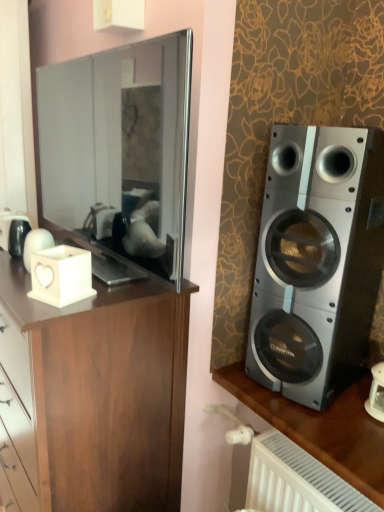
Question: Should I look upward or downward to see matte black mirror at left?

Choices:
 (A) down
 (B) up

Answer: (B)

Question: Should I look upward or downward to see metallic silver speaker at right?

Choices:
 (A) down
 (B) up

Answer: (A)

Question: Does white matte candle holder at left have a smaller size compared to matte black mirror at left?

Choices:
 (A) no
 (B) yes

Answer: (B)

Question: Is white matte candle holder at left looking in the opposite direction of matte black mirror at left?

Choices:
 (A) yes
 (B) no

Answer: (A)

Question: Is white matte candle holder at left far from matte black mirror at left?

Choices:
 (A) yes
 (B) no

Answer: (B)

Question: Does white matte candle holder at left have a larger size compared to matte black mirror at left?

Choices:
 (A) no
 (B) yes

Answer: (A)

Question: Does white matte candle holder at left appear on the left side of matte black mirror at left?

Choices:
 (A) no
 (B) yes

Answer: (B)

Question: Is white matte candle holder at left in front of matte black mirror at left?

Choices:
 (A) no
 (B) yes

Answer: (A)

Question: From the image's perspective, is white matte candle holder at left below metallic silver speaker at right?

Choices:
 (A) yes
 (B) no

Answer: (B)

Question: Is white matte candle holder at left positioned in front of metallic silver speaker at right?

Choices:
 (A) yes
 (B) no

Answer: (A)

Question: From a real-world perspective, is white matte candle holder at left positioned over metallic silver speaker at right based on gravity?

Choices:
 (A) no
 (B) yes

Answer: (B)

Question: Is white matte candle holder at left oriented away from metallic silver speaker at right?

Choices:
 (A) no
 (B) yes

Answer: (A)

Question: Is white matte candle holder at left bigger than metallic silver speaker at right?

Choices:
 (A) no
 (B) yes

Answer: (A)

Question: Considering the relative positions of white matte candle holder at left and metallic silver speaker at right in the image provided, is white matte candle holder at left behind metallic silver speaker at right?

Choices:
 (A) yes
 (B) no

Answer: (B)

Question: From the image's perspective, is matte black mirror at left over silver metallic speaker at right?

Choices:
 (A) no
 (B) yes

Answer: (B)